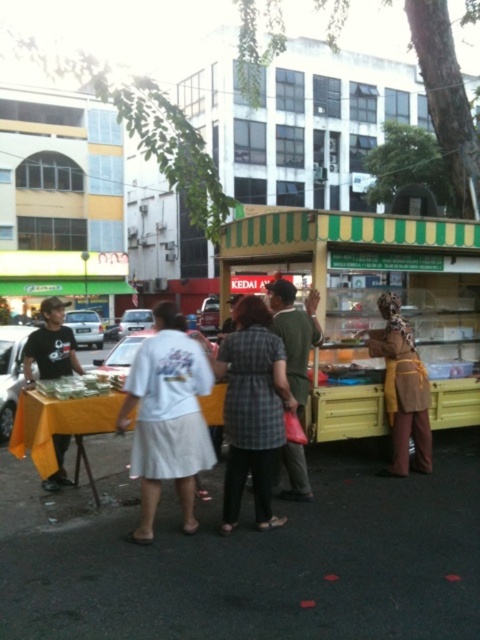
Question: Is yellow-green striped awning at center above plaid fabric shirt at center?

Choices:
 (A) yes
 (B) no

Answer: (A)

Question: Can you confirm if white cotton shirt at center is positioned to the left of matte black t-shirt at left?

Choices:
 (A) no
 (B) yes

Answer: (A)

Question: Which point is farther to the camera?

Choices:
 (A) (204, 458)
 (B) (276, 384)

Answer: (B)

Question: Which of the following is the farthest from the observer?

Choices:
 (A) (45, 336)
 (B) (314, 362)
 (C) (134, 356)

Answer: (B)

Question: From the image, what is the correct spatial relationship of yellow-green striped awning at center in relation to matte black t-shirt at left?

Choices:
 (A) below
 (B) above

Answer: (B)

Question: Which object appears farthest from the camera in this image?

Choices:
 (A) matte black t-shirt at left
 (B) white cotton shirt at center
 (C) yellow-green striped awning at center
 (D) plaid fabric shirt at center

Answer: (C)